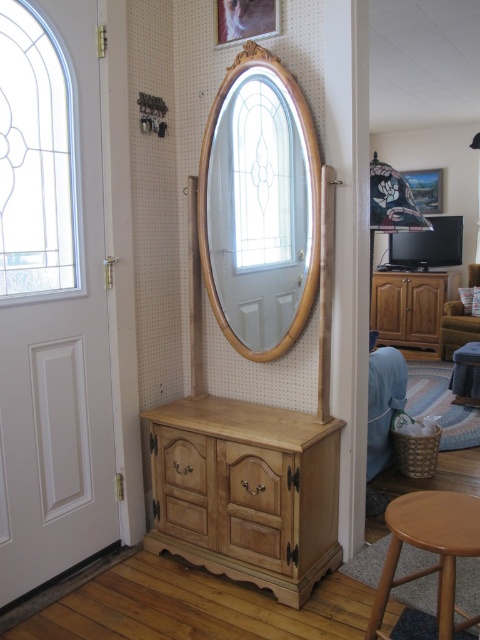
Question: Is light brown wooden dresser at right wider than wooden picture frame at upper right?

Choices:
 (A) yes
 (B) no

Answer: (A)

Question: Is light wood dresser at center below velvet green armchair at right?

Choices:
 (A) no
 (B) yes

Answer: (B)

Question: Estimate the real-world distances between objects in this image. Which object is farther from the velvet green armchair at right?

Choices:
 (A) wooden mirror at center
 (B) light wood dresser at center
 (C) light brown wooden stool at lower right
 (D) light brown wooden dresser at right

Answer: (C)

Question: Where is light wood dresser at center located in relation to velvet green armchair at right in the image?

Choices:
 (A) left
 (B) right

Answer: (A)

Question: Which point appears closest to the camera in this image?

Choices:
 (A) (477, 330)
 (B) (236, 29)

Answer: (B)

Question: Which point appears farthest from the camera in this image?

Choices:
 (A) (418, 520)
 (B) (238, 32)
 (C) (273, 124)

Answer: (B)